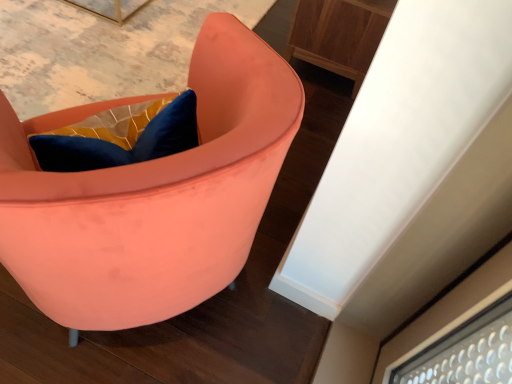
Question: Can you confirm if wooden cabinet at upper right is positioned to the right of matte coral chair at center?

Choices:
 (A) no
 (B) yes

Answer: (B)

Question: From a real-world perspective, is wooden cabinet at upper right over matte coral chair at center?

Choices:
 (A) no
 (B) yes

Answer: (A)

Question: Is wooden cabinet at upper right shorter than matte coral chair at center?

Choices:
 (A) no
 (B) yes

Answer: (B)

Question: From the image's perspective, is wooden cabinet at upper right under matte coral chair at center?

Choices:
 (A) no
 (B) yes

Answer: (A)

Question: From a real-world perspective, is wooden cabinet at upper right beneath matte coral chair at center?

Choices:
 (A) yes
 (B) no

Answer: (A)

Question: Is wooden cabinet at upper right thinner than matte coral chair at center?

Choices:
 (A) yes
 (B) no

Answer: (A)

Question: Does matte coral chair at center have a greater width compared to wooden cabinet at upper right?

Choices:
 (A) no
 (B) yes

Answer: (B)

Question: From the image's perspective, is matte coral chair at center above wooden cabinet at upper right?

Choices:
 (A) no
 (B) yes

Answer: (A)

Question: Does matte coral chair at center come in front of wooden cabinet at upper right?

Choices:
 (A) yes
 (B) no

Answer: (A)

Question: Is matte coral chair at center behind wooden cabinet at upper right?

Choices:
 (A) no
 (B) yes

Answer: (A)

Question: From a real-world perspective, is matte coral chair at center over wooden cabinet at upper right?

Choices:
 (A) no
 (B) yes

Answer: (B)

Question: Does matte coral chair at center have a lesser height compared to wooden cabinet at upper right?

Choices:
 (A) yes
 (B) no

Answer: (B)

Question: From a real-world perspective, relative to wooden cabinet at upper right, is matte coral chair at center vertically above or below?

Choices:
 (A) above
 (B) below

Answer: (A)